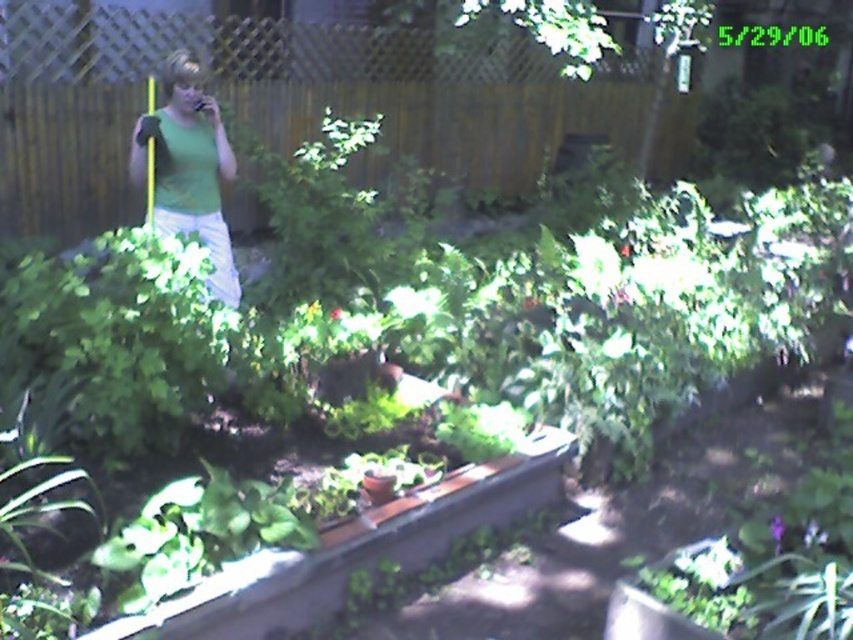
Question: Can you confirm if green leafy plant at center is positioned below green matte shirt at upper left?

Choices:
 (A) yes
 (B) no

Answer: (A)

Question: Which point is farther from the camera taking this photo?

Choices:
 (A) (677, 621)
 (B) (238, 609)
 (C) (154, 125)

Answer: (C)

Question: Which object is closer to the camera taking this photo?

Choices:
 (A) green matte shirt at upper left
 (B) green leafy plant at center

Answer: (B)

Question: Is green leafy plant at center bigger than green leafy plant at lower right?

Choices:
 (A) no
 (B) yes

Answer: (B)

Question: Where is green matte shirt at upper left located in relation to green leafy plant at lower right in the image?

Choices:
 (A) left
 (B) right

Answer: (A)

Question: Considering the real-world distances, which object is closest to the green leafy plant at lower right?

Choices:
 (A) green leafy plant at center
 (B) green matte shirt at upper left

Answer: (A)